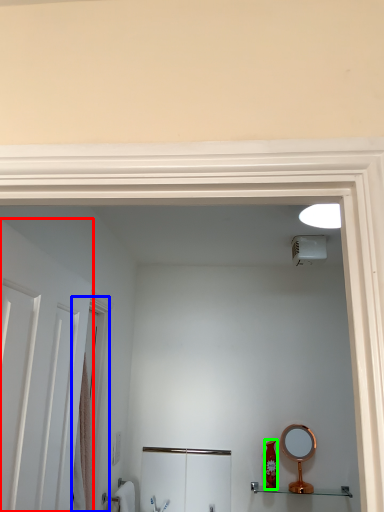
Question: Based on their relative distances, which object is farther from door (highlighted by a red box)? Choose from screen door (highlighted by a blue box) and toiletry (highlighted by a green box).

Choices:
 (A) screen door
 (B) toiletry

Answer: (B)